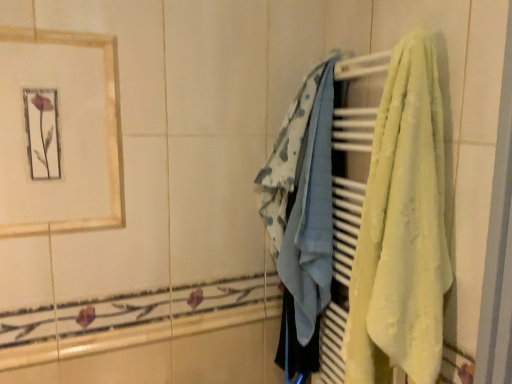
This screenshot has width=512, height=384. Find the location of `gold-framed picture at upper left`. gold-framed picture at upper left is located at coordinates (61, 133).

In order to face gold-framed picture at upper left, should I rotate leftwards or rightwards?

It's best to rotate left around 24.187 degrees.

In order to click on gold-framed picture at upper left in this screenshot , I will do `click(61, 133)`.

Is yellow soft towel at right, the 1th towel in the right-to-left sequence, bigger than gold-framed picture at upper left?

Indeed, yellow soft towel at right, the 1th towel in the right-to-left sequence, has a larger size compared to gold-framed picture at upper left.

Consider the image. Is yellow soft towel at right, which is counted as the second towel, starting from the left, turned away from gold-framed picture at upper left?

No, yellow soft towel at right, which is counted as the second towel, starting from the left, is not facing the opposite direction of gold-framed picture at upper left.

Could gold-framed picture at upper left be considered to be inside yellow soft towel at right, the 1th towel in the right-to-left sequence?

Definitely not — gold-framed picture at upper left is not inside yellow soft towel at right, the 1th towel in the right-to-left sequence.

From the picture: Is yellow soft towel at right, which is counted as the second towel, starting from the left, not close to gold-framed picture at upper left?

They are positioned close to each other.

Where is `towel in front of the light blue fabric at center, which is the second towel from right to left`? The image size is (512, 384). towel in front of the light blue fabric at center, which is the second towel from right to left is located at coordinates (402, 229).

Considering the positions of objects yellow soft towel at right, the 1th towel in the right-to-left sequence, and light blue fabric at center, positioned as the 1th towel in left-to-right order, in the image provided, who is in front, yellow soft towel at right, the 1th towel in the right-to-left sequence, or light blue fabric at center, positioned as the 1th towel in left-to-right order,?

Positioned in front is yellow soft towel at right, the 1th towel in the right-to-left sequence.

Looking at the image, does yellow soft towel at right, which appears as the first towel when viewed from the front, seem bigger or smaller compared to light blue fabric at center, which is the second towel from right to left?

Considering their sizes, yellow soft towel at right, which appears as the first towel when viewed from the front, takes up more space than light blue fabric at center, which is the second towel from right to left.

How far apart are yellow soft towel at right, placed as the second towel when sorted from back to front, and light blue fabric at center, which ranks as the 1th towel in back-to-front order?

A distance of 12.46 inches exists between yellow soft towel at right, placed as the second towel when sorted from back to front, and light blue fabric at center, which ranks as the 1th towel in back-to-front order.

Considering the positions of objects gold-framed picture at upper left and yellow soft towel at right, placed as the second towel when sorted from back to front, in the image provided, who is in front, gold-framed picture at upper left or yellow soft towel at right, placed as the second towel when sorted from back to front,?

yellow soft towel at right, placed as the second towel when sorted from back to front.

Is yellow soft towel at right, the 1th towel in the right-to-left sequence, located within gold-framed picture at upper left?

No, yellow soft towel at right, the 1th towel in the right-to-left sequence, is not a part of gold-framed picture at upper left.

Which point is more distant from viewer, (103,94) or (380,341)?

Point (103,94)

Are gold-framed picture at upper left and yellow soft towel at right, the 1th towel in the right-to-left sequence, far apart?

No, gold-framed picture at upper left is not far from yellow soft towel at right, the 1th towel in the right-to-left sequence.

Is gold-framed picture at upper left located within light blue fabric at center, which is the second towel from right to left?

No.

Is there a large distance between light blue fabric at center, which is the second towel from right to left, and gold-framed picture at upper left?

light blue fabric at center, which is the second towel from right to left, is near gold-framed picture at upper left, not far away.

From a real-world perspective, is light blue fabric at center, which ranks as the 1th towel in back-to-front order, below gold-framed picture at upper left?

Yes, from a real-world perspective, light blue fabric at center, which ranks as the 1th towel in back-to-front order, is under gold-framed picture at upper left.

Considering the sizes of objects light blue fabric at center, which ranks as the 1th towel in back-to-front order, and gold-framed picture at upper left in the image provided, who is shorter, light blue fabric at center, which ranks as the 1th towel in back-to-front order, or gold-framed picture at upper left?

Standing shorter between the two is gold-framed picture at upper left.

Which of these two, light blue fabric at center, the second towel in the front-to-back sequence, or yellow soft towel at right, which appears as the first towel when viewed from the front, is smaller?

Answer: light blue fabric at center, the second towel in the front-to-back sequence.

In the scene shown: Which object is closer to the camera taking this photo, light blue fabric at center, which is the second towel from right to left, or yellow soft towel at right, which appears as the first towel when viewed from the front?

Result: yellow soft towel at right, which appears as the first towel when viewed from the front, is in front.

Based on the photo, could you tell me if light blue fabric at center, which ranks as the 1th towel in back-to-front order, is facing yellow soft towel at right, which is counted as the second towel, starting from the left?

No.

Could you tell me if gold-framed picture at upper left is turned towards light blue fabric at center, the second towel in the front-to-back sequence?

No, gold-framed picture at upper left is not oriented towards light blue fabric at center, the second towel in the front-to-back sequence.

In the scene shown: Can you see gold-framed picture at upper left touching light blue fabric at center, which is the second towel from right to left?

gold-framed picture at upper left is not next to light blue fabric at center, which is the second towel from right to left, and they're not touching.

Considering the sizes of objects gold-framed picture at upper left and light blue fabric at center, the second towel in the front-to-back sequence, in the image provided, who is wider, gold-framed picture at upper left or light blue fabric at center, the second towel in the front-to-back sequence,?

Wider between the two is light blue fabric at center, the second towel in the front-to-back sequence.

At what (x,y) coordinates should I click in order to perform the action: click on picture frame that appears above the light blue fabric at center, which is the second towel from right to left (from the image's perspective). Please return your answer as a coordinate pair (x, y). Looking at the image, I should click on (61, 133).

This screenshot has width=512, height=384. Find the location of `towel in front of the gold-framed picture at upper left`. towel in front of the gold-framed picture at upper left is located at coordinates (402, 229).

Locate an element on the screen. The height and width of the screenshot is (384, 512). towel that is below the light blue fabric at center, positioned as the 1th towel in left-to-right order (from the image's perspective) is located at coordinates (402, 229).

When comparing their distances from light blue fabric at center, positioned as the 1th towel in left-to-right order, does yellow soft towel at right, which appears as the first towel when viewed from the front, or gold-framed picture at upper left seem further?

gold-framed picture at upper left.

Considering their positions, is yellow soft towel at right, which appears as the first towel when viewed from the front, positioned further to gold-framed picture at upper left than light blue fabric at center, the second towel in the front-to-back sequence?

yellow soft towel at right, which appears as the first towel when viewed from the front.

From the image, which object appears to be farther from light blue fabric at center, positioned as the 1th towel in left-to-right order, gold-framed picture at upper left or yellow soft towel at right, placed as the second towel when sorted from back to front?

gold-framed picture at upper left.

Which object lies further to the anchor point yellow soft towel at right, placed as the second towel when sorted from back to front, light blue fabric at center, the second towel in the front-to-back sequence, or gold-framed picture at upper left?

gold-framed picture at upper left lies further to yellow soft towel at right, placed as the second towel when sorted from back to front, than the other object.

Considering their positions, is light blue fabric at center, positioned as the 1th towel in left-to-right order, positioned closer to gold-framed picture at upper left than yellow soft towel at right, which is counted as the second towel, starting from the left?

Among the two, light blue fabric at center, positioned as the 1th towel in left-to-right order, is located nearer to gold-framed picture at upper left.

From the picture: Looking at the image, which one is located further to yellow soft towel at right, which appears as the first towel when viewed from the front, gold-framed picture at upper left or light blue fabric at center, positioned as the 1th towel in left-to-right order?

The object further to yellow soft towel at right, which appears as the first towel when viewed from the front, is gold-framed picture at upper left.

I want to click on towel between gold-framed picture at upper left and yellow soft towel at right, which appears as the first towel when viewed from the front, so click(302, 215).